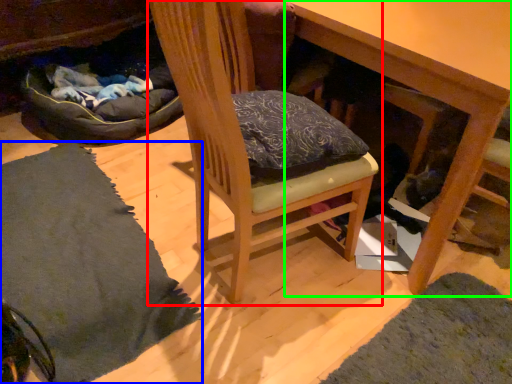
Question: Which object is the closest to the chair (highlighted by a red box)? Choose among these: mat (highlighted by a blue box) or table (highlighted by a green box).

Choices:
 (A) mat
 (B) table

Answer: (B)